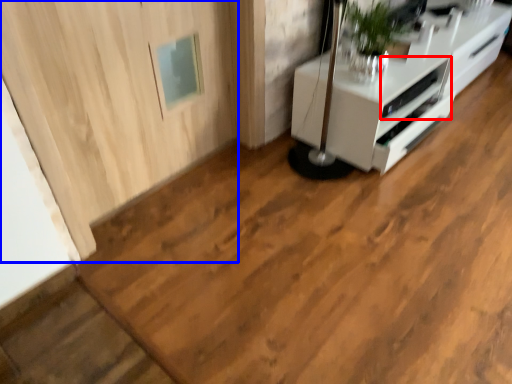
Question: Among these objects, which one is nearest to the camera, appliance (highlighted by a red box) or door (highlighted by a blue box)?

Choices:
 (A) appliance
 (B) door

Answer: (B)